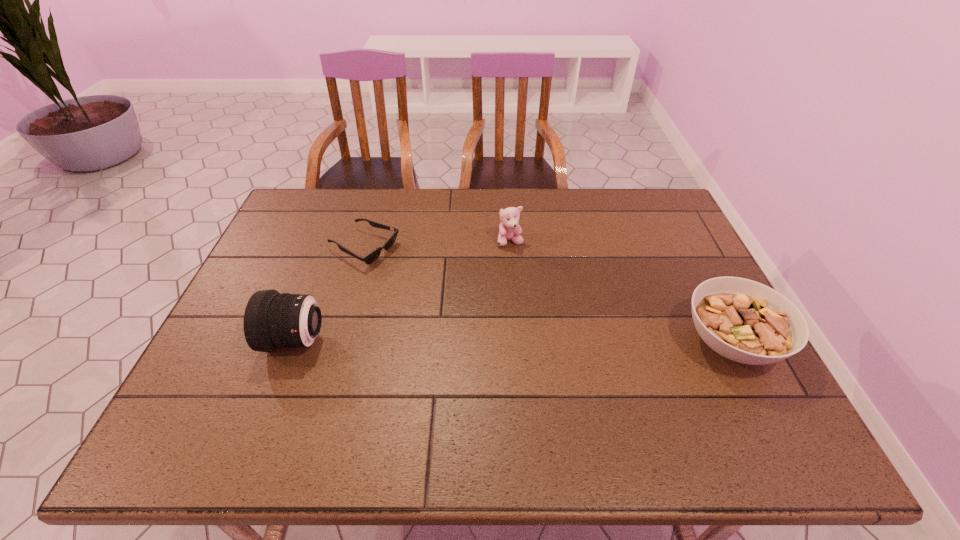
Where is `free space on the desktop that is between the tallest object and the rightmost object and is positioned at the face of the third object from left to right`? This screenshot has width=960, height=540. free space on the desktop that is between the tallest object and the rightmost object and is positioned at the face of the third object from left to right is located at coordinates (499, 341).

The height and width of the screenshot is (540, 960). Identify the location of vacant space on the desktop that is between the tallest object and the rightmost object and is positioned on the front-facing side of the sunglasses. (572, 342).